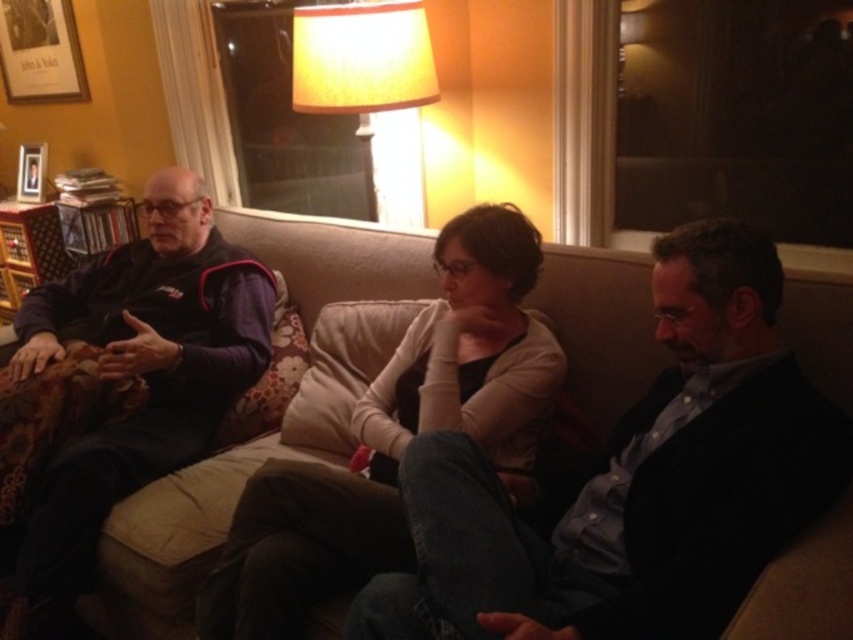
Which is in front, point (793, 593) or point (361, 29)?

Positioned in front is point (793, 593).

Can you confirm if beige fabric couch at center is positioned above yellow fabric lampshade at upper center?

No, beige fabric couch at center is not above yellow fabric lampshade at upper center.

Find the location of a particular element. This screenshot has height=640, width=853. beige fabric couch at center is located at coordinates (173, 541).

Which is behind, point (328, 593) or point (27, 147)?

Point (27, 147)

The width and height of the screenshot is (853, 640). What do you see at coordinates (396, 436) in the screenshot? I see `light beige couch cushion at center` at bounding box center [396, 436].

You are a GUI agent. You are given a task and a screenshot of the screen. Output one action in this format:
    pyautogui.click(x=<x>, y=<y>)
    Task: Click on the light beige couch cushion at center
    The width and height of the screenshot is (853, 640).
    Given the screenshot: What is the action you would take?
    pyautogui.click(x=396, y=436)

Is point (163, 323) positioned behind point (410, 220)?

No, it is not.

From the picture: Who is more distant from viewer, (221, 374) or (395, 35)?

Positioned behind is point (395, 35).

Who is more forward, (90, 305) or (347, 26)?

Point (347, 26)

Where is `dark blue fleece jacket at left`? dark blue fleece jacket at left is located at coordinates (140, 371).